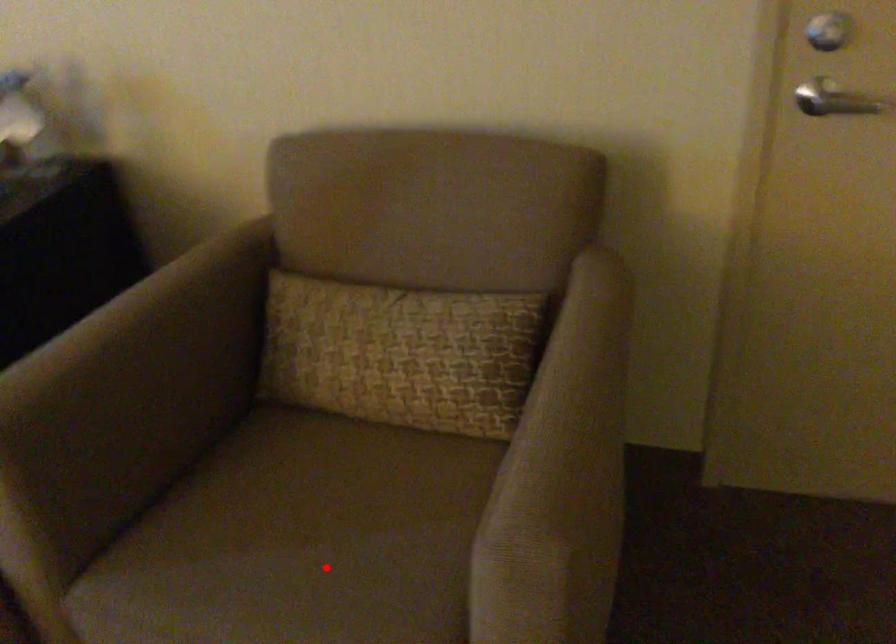
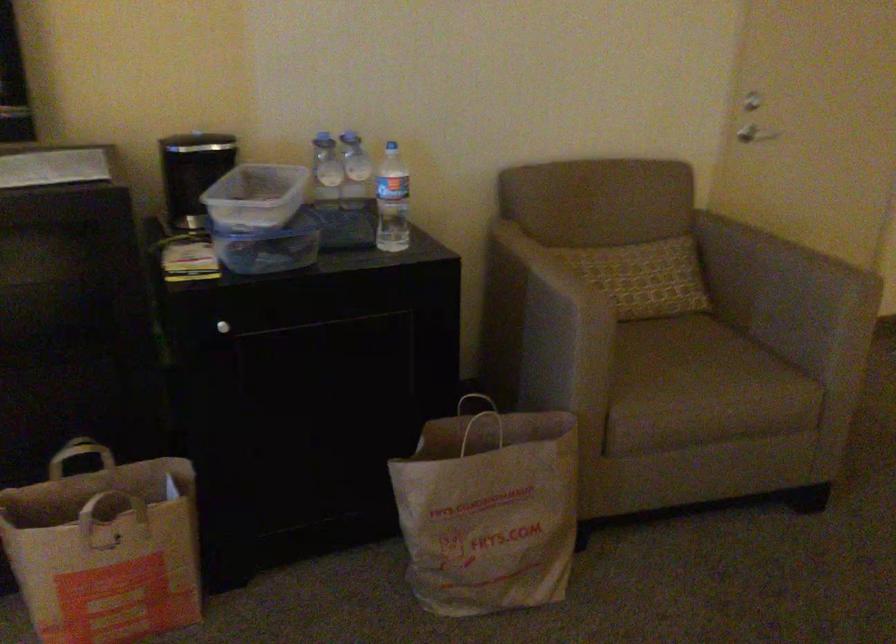
Find the pixel in the second image that matches the highlighted location in the first image.

(707, 366)